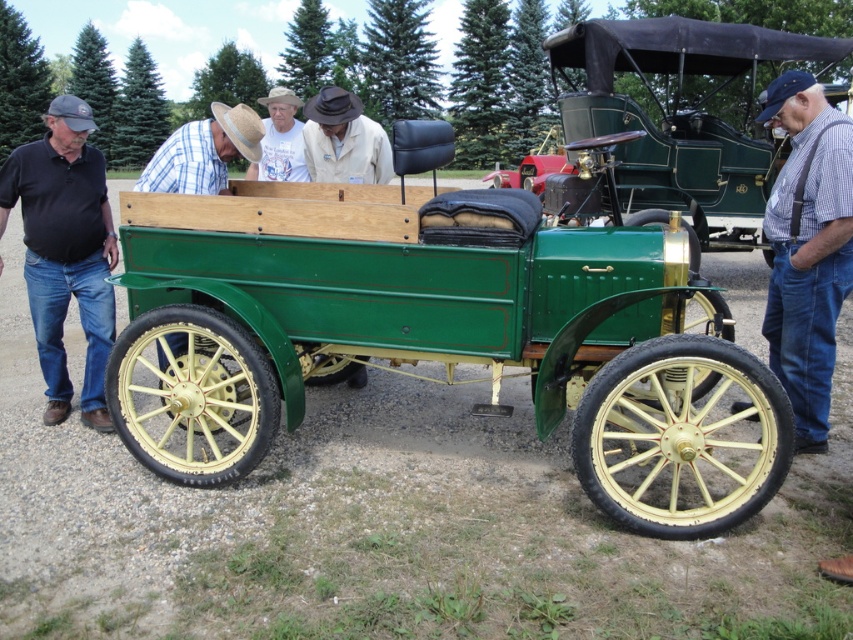
In the scene shown: You are a tailor examining two shirts in the image. The black cotton shirt at left and plaid shirt at center. Which shirt is positioned lower in the scene?

The black cotton shirt at left is located below the plaid shirt at center, so it is positioned lower in the scene.

In the scene shown: You see two shirts in the image, a black cotton shirt at left and a plaid shirt at center. Which shirt is positioned more to the left side of the image?

The black cotton shirt at left is positioned more to the left side of the image than the plaid shirt at center.

You are a delivery person who needs to place a package on the white cotton shirt at center and the strawhat at center. What is the minimum distance you need to cover to place the package on both items?

The minimum distance you need to cover to place the package on both the white cotton shirt at center and the strawhat at center is 4.86 meters.